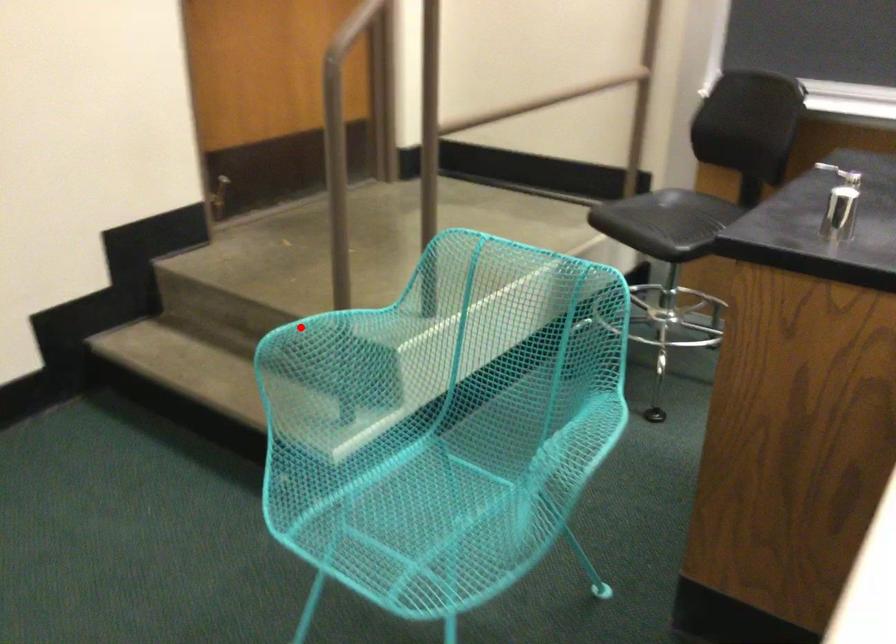
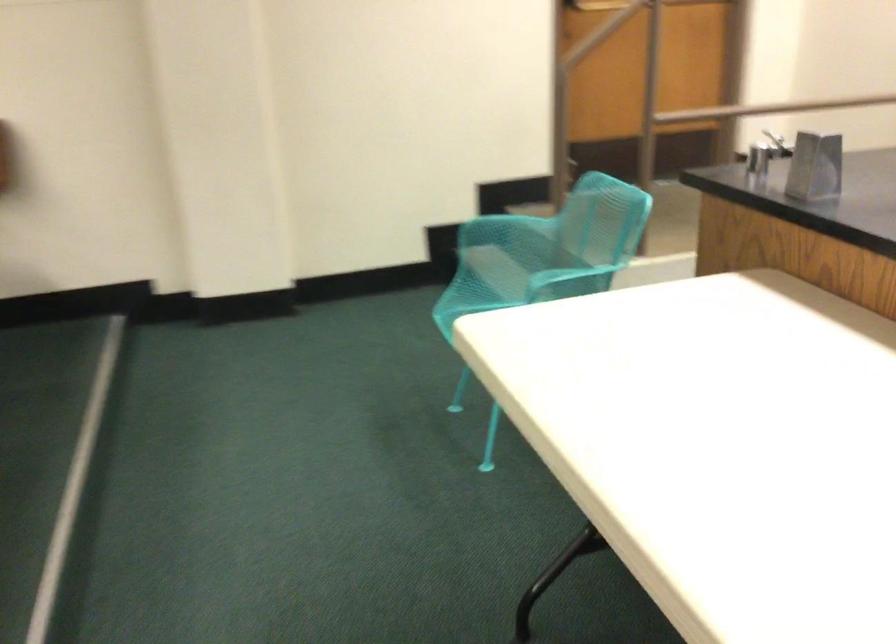
Where in the second image is the point corresponding to the highlighted location from the first image?

(494, 218)